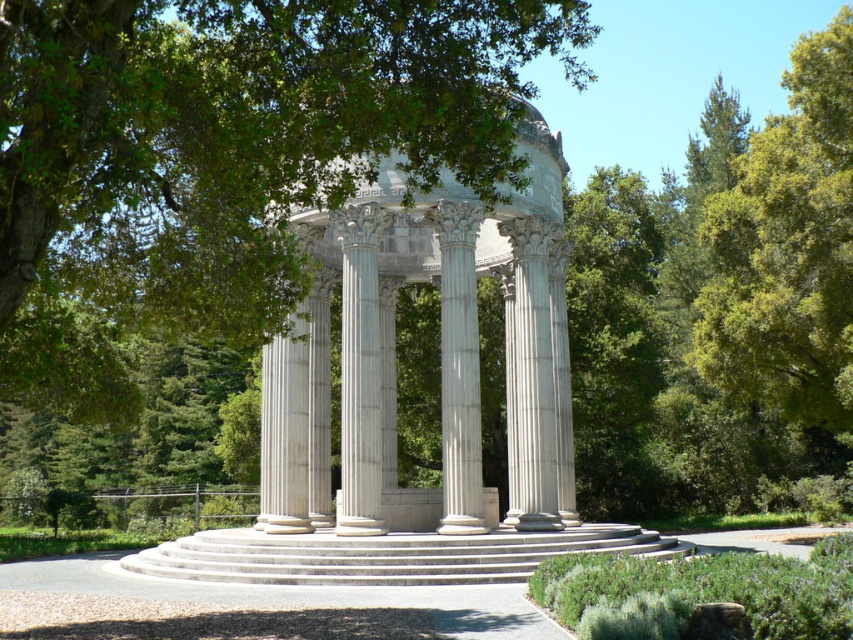
Question: Can you confirm if green leafy tree at center is bigger than white marble gazebo at center?

Choices:
 (A) no
 (B) yes

Answer: (B)

Question: Which of the following is the closest to the observer?

Choices:
 (A) green leafy tree at center
 (B) white marble column at center

Answer: (A)

Question: Which object appears farthest from the camera in this image?

Choices:
 (A) white marble column at center
 (B) green leafy tree at center

Answer: (A)

Question: Does green leafy tree at center come behind white marble gazebo at center?

Choices:
 (A) yes
 (B) no

Answer: (B)

Question: Can you confirm if green leafy tree at center is thinner than white marble column at center?

Choices:
 (A) yes
 (B) no

Answer: (B)

Question: Which of the following is the closest to the observer?

Choices:
 (A) green leafy tree at center
 (B) white marble gazebo at center
 (C) white marble column at center

Answer: (A)